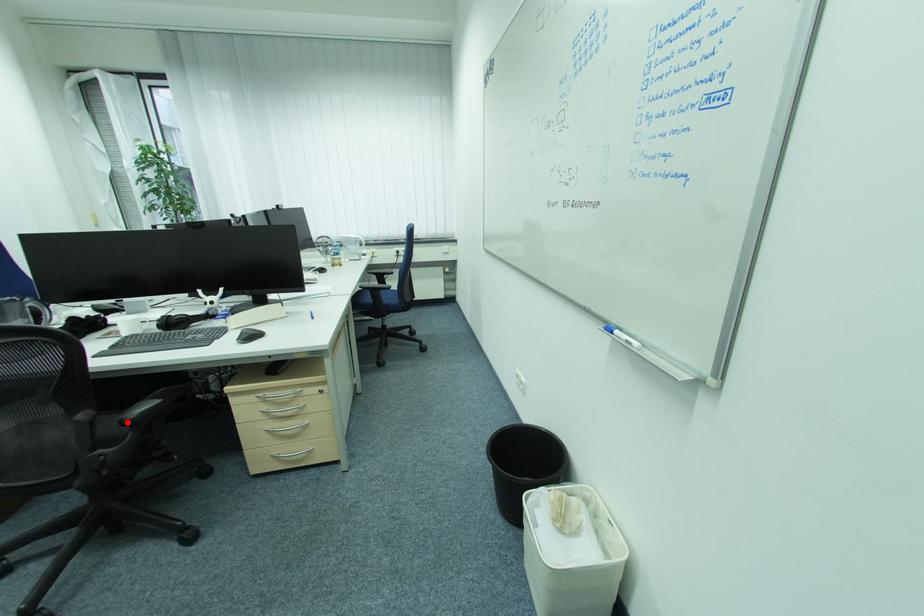
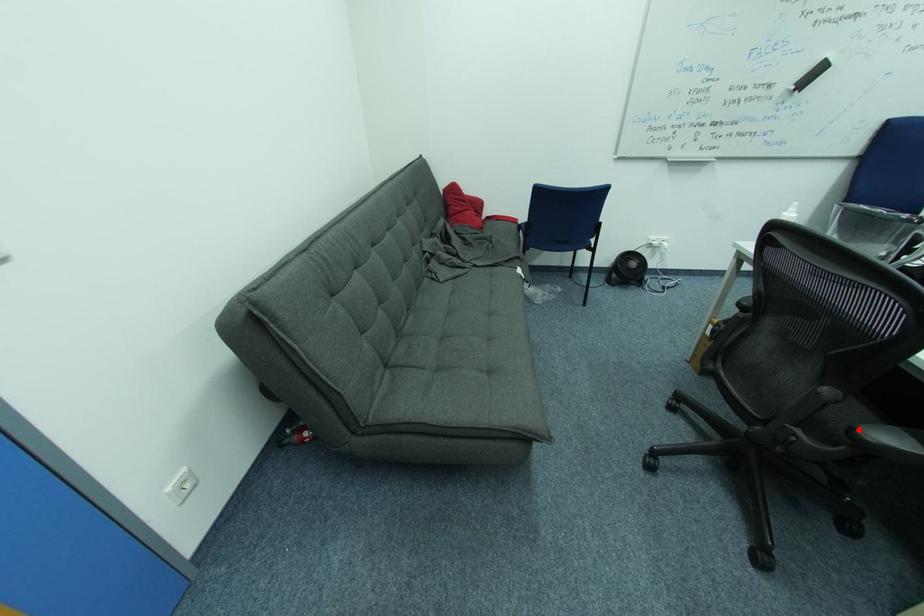
I am providing you with two images of the same scene from different viewpoints. A red point is marked on the first image and another point is marked on the second image. Is the red point in image1 aligned with the point shown in image2?

Yes